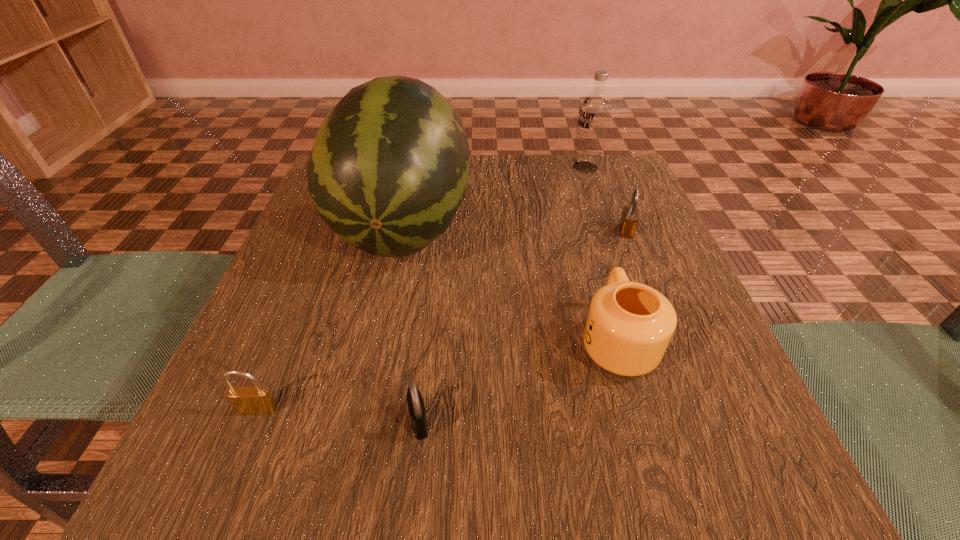
Where is `vacant space that satisfies the following two spatial constraints: 1. on the handle side of the third nearest object; 2. on the left side of the farthest padlock`? Image resolution: width=960 pixels, height=540 pixels. vacant space that satisfies the following two spatial constraints: 1. on the handle side of the third nearest object; 2. on the left side of the farthest padlock is located at coordinates (585, 231).